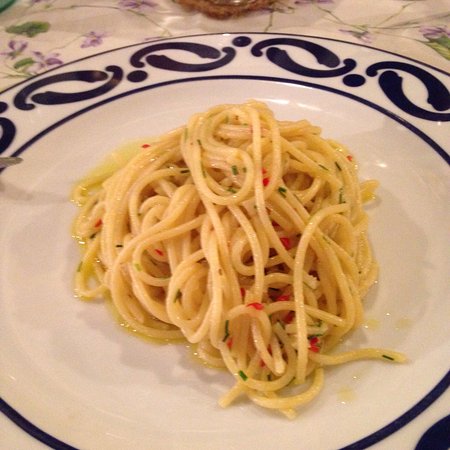
Image resolution: width=450 pixels, height=450 pixels. Find the location of `plate`. plate is located at coordinates (139, 419).